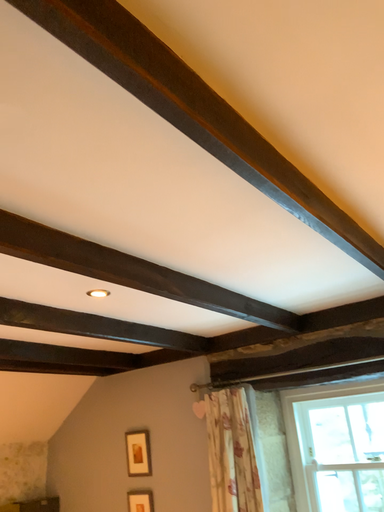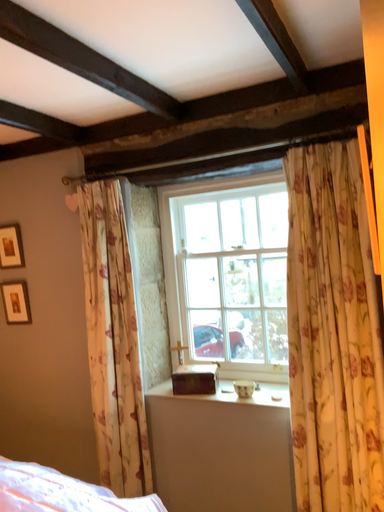
Question: Which way did the camera rotate in the video?

Choices:
 (A) rotated upward
 (B) rotated downward

Answer: (B)